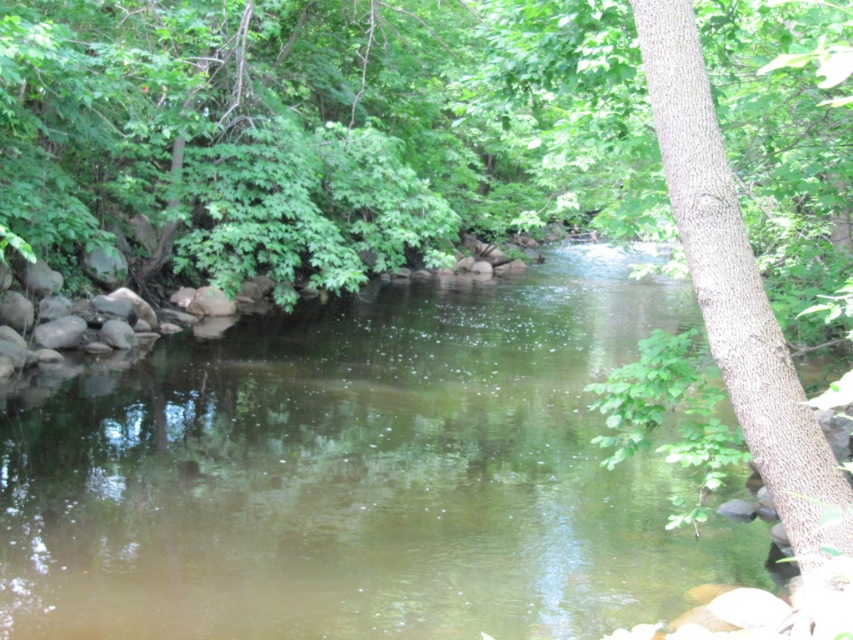
You are an environmental scientist assessing the health of the river. You observe the green smooth water at center and the brown textured tree trunk at right. Which object in the scene occupies a larger area?

The green smooth water at center occupies a larger area than the brown textured tree trunk at right according to the description.

You are standing on the rocky shoreline and want to cross to the tree trunk. Which direction should you walk to reach the brown textured tree trunk at right from the green smooth water at center?

To reach the brown textured tree trunk at right from the green smooth water at center, you should walk to the right since the green smooth water at center is located to the left of the tree trunk.